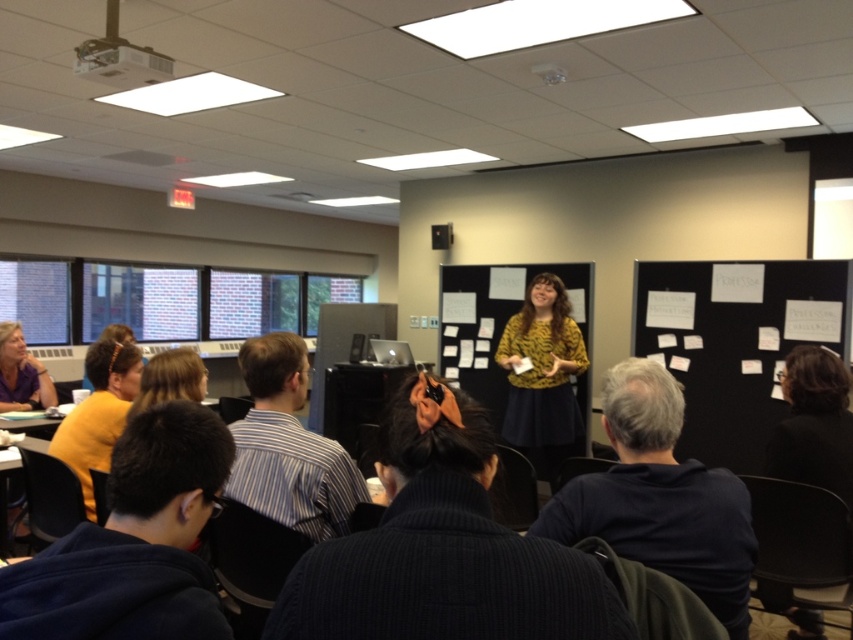
Question: Which point is closer to the camera?

Choices:
 (A) (534, 364)
 (B) (788, 403)

Answer: (B)

Question: Which object appears closest to the camera in this image?

Choices:
 (A) yellow fabric hairband at lower left
 (B) black fabric bulletin board at center
 (C) matte white projector at upper left
 (D) blonde hair at center

Answer: (D)

Question: Does black fabric bulletin board at center have a larger size compared to black fabric jacket at lower right?

Choices:
 (A) yes
 (B) no

Answer: (A)

Question: Is matte white projector at upper left positioned behind blonde hair at center?

Choices:
 (A) yes
 (B) no

Answer: (A)

Question: Based on their relative distances, which object is nearer to the black fabric bulletin board at center?

Choices:
 (A) yellow fabric hairband at lower left
 (B) black fabric jacket at lower right
 (C) matte white projector at upper left

Answer: (B)

Question: From the image, what is the correct spatial relationship of matte purple blouse at lower left in relation to blonde hair at center?

Choices:
 (A) right
 (B) left

Answer: (B)